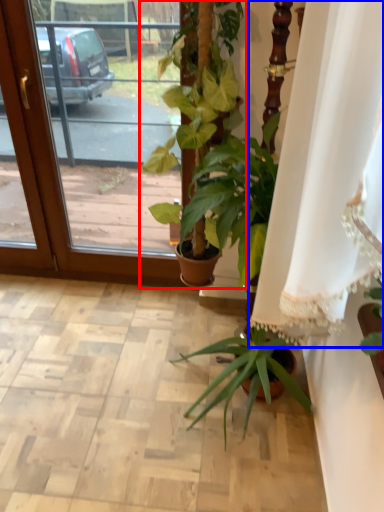
Question: Which object appears closest to the camera in this image, houseplant (highlighted by a red box) or curtain (highlighted by a blue box)?

Choices:
 (A) houseplant
 (B) curtain

Answer: (B)